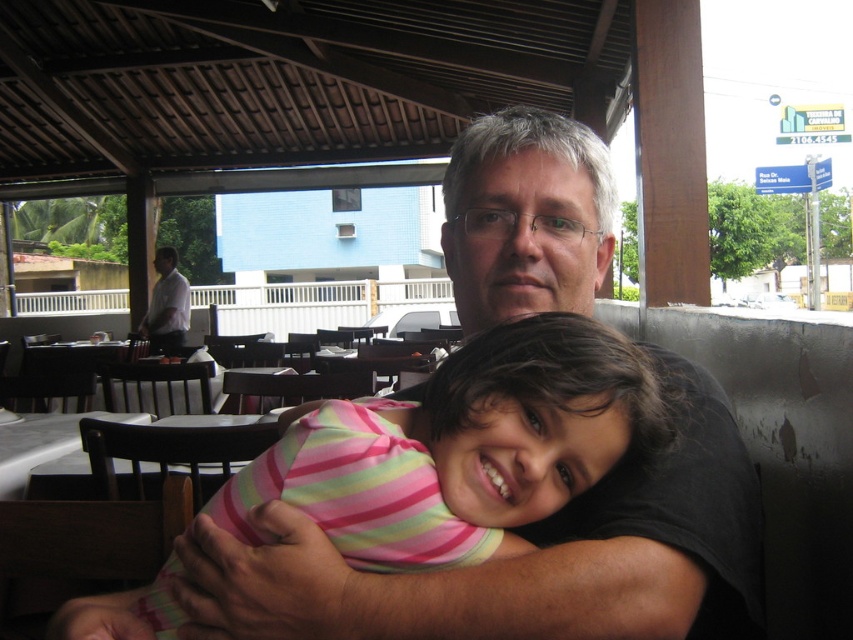
You are a photographer trying to capture a candid shot of the two subjects in the scene. You want to ensure that both the pink striped shirt at center and the white shirt at left are clearly visible in the frame. Given their relative sizes, which shirt should you focus on to ensure proper exposure, and why?

The pink striped shirt at center is thinner than the white shirt at left, so you should focus on the white shirt at left for proper exposure because it is larger and more likely to be properly exposed in the frame.

You are a photographer trying to capture the child in the pink and yellow striped top. The child is represented by the point at coordinates point [460,449]. Where should you position your camera to ensure the child is centered in your shot?

To center the child in the shot, position the camera so that the point [460,449] is at the center of the frame.